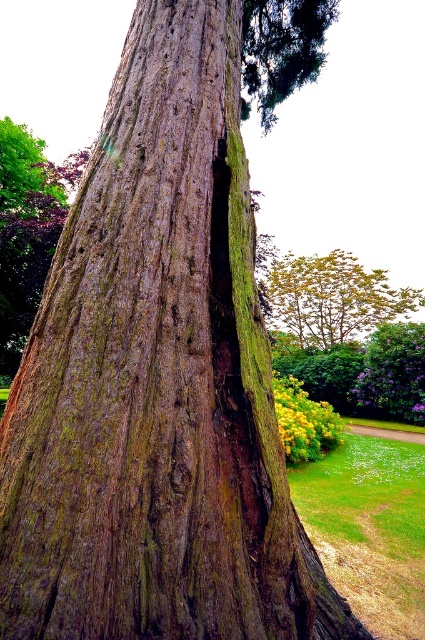
You are standing in a garden and see a tree trunk with moss patches. There is a specific point at coordinates (334,298). What object is located at that point?

The point at coordinates (334,298) is where the yellow green textured tree trunk at upper right is located.